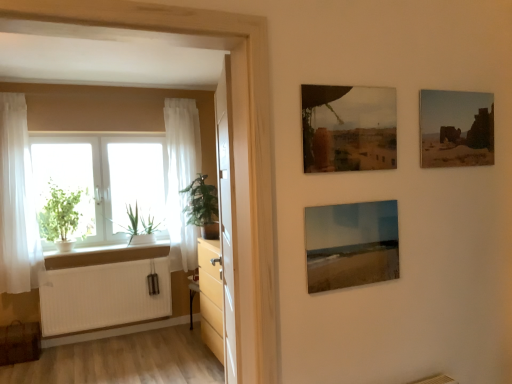
Question: Does green leafy plant at left, placed as the second houseplant when sorted from left to right, have a greater height compared to white ribbed radiator at lower left?

Choices:
 (A) yes
 (B) no

Answer: (B)

Question: Can you confirm if green leafy plant at left, placed as the second houseplant when sorted from left to right, is shorter than white ribbed radiator at lower left?

Choices:
 (A) yes
 (B) no

Answer: (A)

Question: Does green leafy plant at left, placed as the second houseplant when sorted from left to right, have a smaller size compared to white ribbed radiator at lower left?

Choices:
 (A) no
 (B) yes

Answer: (B)

Question: Can you confirm if green leafy plant at left, marked as the first houseplant in a right-to-left arrangement, is positioned to the left of white ribbed radiator at lower left?

Choices:
 (A) yes
 (B) no

Answer: (B)

Question: Is green leafy plant at left, marked as the first houseplant in a right-to-left arrangement, facing away from white ribbed radiator at lower left?

Choices:
 (A) yes
 (B) no

Answer: (B)

Question: From the image's perspective, is green leafy plant at left, marked as the first houseplant in a right-to-left arrangement, over white ribbed radiator at lower left?

Choices:
 (A) yes
 (B) no

Answer: (A)

Question: From the image's perspective, is green matte plant at left, arranged as the 2th houseplant when viewed from the right, on top of white sheer curtain at left, the 1th curtain viewed from the right?

Choices:
 (A) yes
 (B) no

Answer: (B)

Question: Is white sheer curtain at left, the second curtain when ordered from front to back, at the back of green matte plant at left, arranged as the first houseplant when viewed from the left?

Choices:
 (A) no
 (B) yes

Answer: (A)

Question: Does green matte plant at left, arranged as the 2th houseplant when viewed from the right, turn towards white sheer curtain at left, positioned as the second curtain in left-to-right order?

Choices:
 (A) no
 (B) yes

Answer: (A)

Question: Can you confirm if green matte plant at left, arranged as the first houseplant when viewed from the left, is taller than white sheer curtain at left, positioned as the second curtain in left-to-right order?

Choices:
 (A) no
 (B) yes

Answer: (A)

Question: Can you confirm if green matte plant at left, arranged as the first houseplant when viewed from the left, is wider than white sheer curtain at left, placed as the first curtain when sorted from back to front?

Choices:
 (A) no
 (B) yes

Answer: (B)

Question: Does green matte plant at left, arranged as the 2th houseplant when viewed from the right, appear on the right side of white sheer curtain at left, positioned as the second curtain in left-to-right order?

Choices:
 (A) yes
 (B) no

Answer: (B)

Question: Is the surface of green leafy plant at left in direct contact with white glass window at left?

Choices:
 (A) no
 (B) yes

Answer: (A)